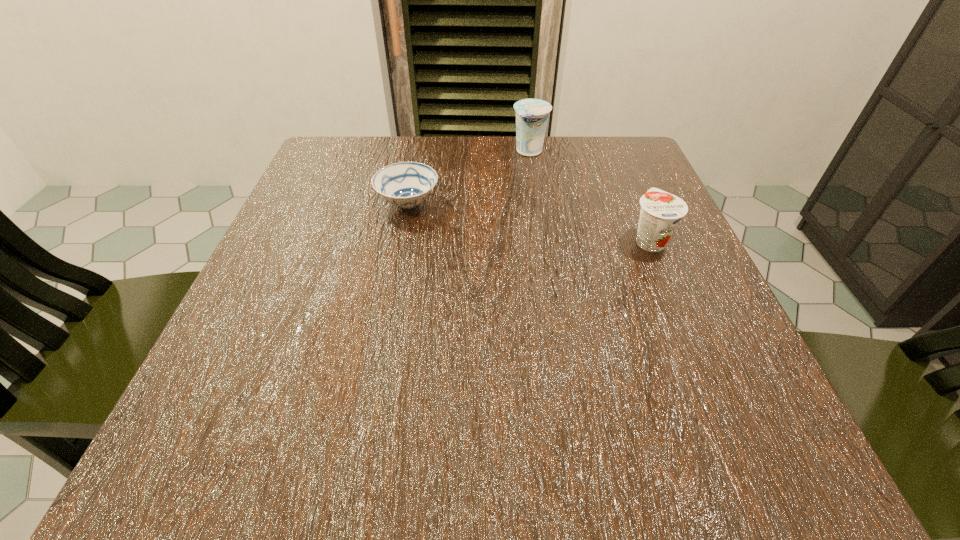
Where is `free area in between the tallest object and the shortest object`? The width and height of the screenshot is (960, 540). free area in between the tallest object and the shortest object is located at coordinates (468, 177).

At what (x,y) coordinates should I click in order to perform the action: click on free point between the taller yogurt and the nearer yogurt. Please return your answer as a coordinate pair (x, y). Image resolution: width=960 pixels, height=540 pixels. Looking at the image, I should click on (589, 196).

Image resolution: width=960 pixels, height=540 pixels. I want to click on free space that is in between the left yogurt and the shortest object, so click(468, 177).

Find the location of a particular element. Image resolution: width=960 pixels, height=540 pixels. vacant area between the taller yogurt and the rightmost object is located at coordinates (589, 196).

The image size is (960, 540). I want to click on vacant area that lies between the nearer yogurt and the second nearest object, so click(529, 222).

Locate an element on the screen. The width and height of the screenshot is (960, 540). free spot between the shortest object and the rightmost object is located at coordinates (529, 222).

The height and width of the screenshot is (540, 960). In order to click on vacant space that's between the left yogurt and the leftmost object in this screenshot , I will do `click(468, 177)`.

Find the location of a particular element. The height and width of the screenshot is (540, 960). free space between the farthest object and the second tallest object is located at coordinates (589, 196).

The image size is (960, 540). Identify the location of free space between the nearest object and the farther yogurt. (589, 196).

At what (x,y) coordinates should I click in order to perform the action: click on object that is the second closest one to the farther yogurt. Please return your answer as a coordinate pair (x, y). Looking at the image, I should click on (660, 213).